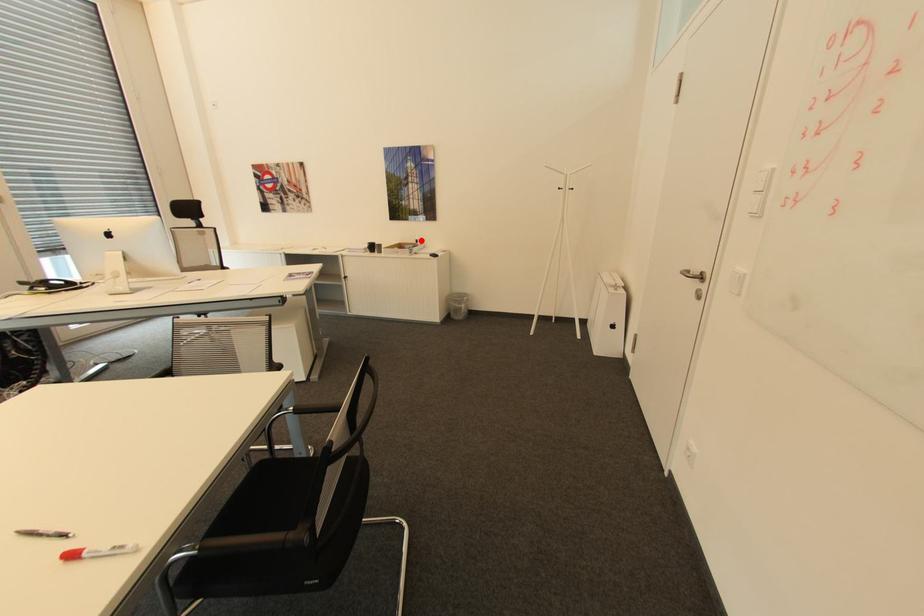
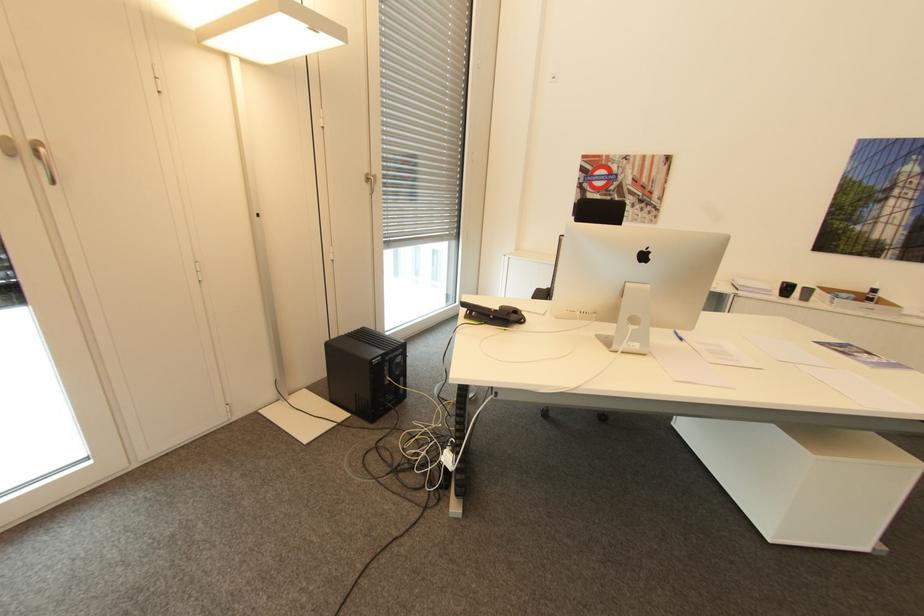
Find the pixel in the second image that matches the highlighted location in the first image.

(879, 290)